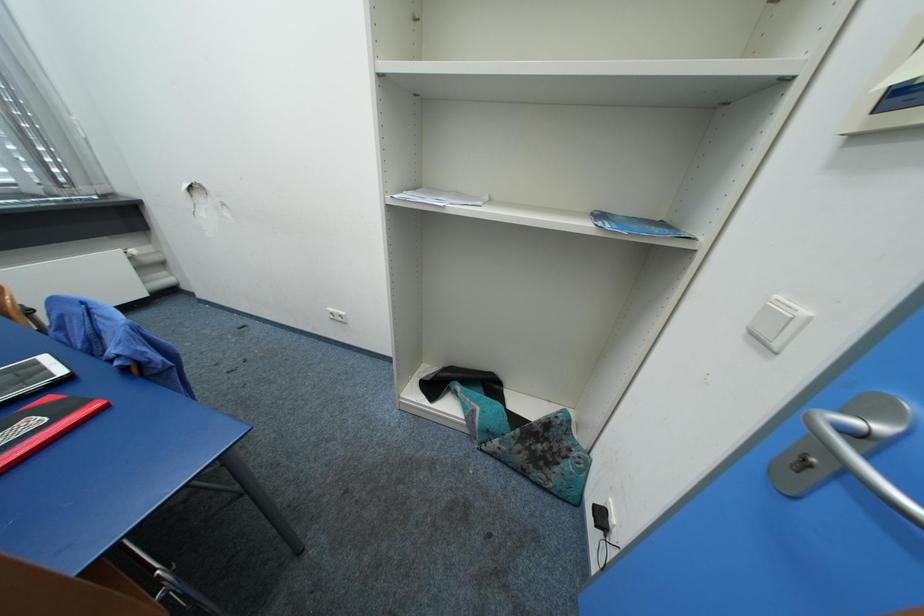
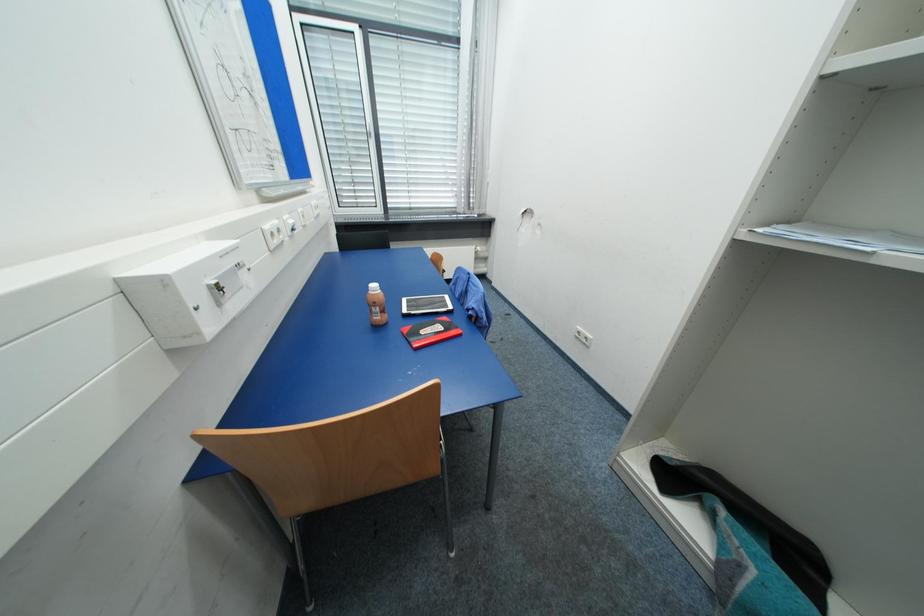
Question: How did the camera likely rotate?

Choices:
 (A) Left
 (B) Right
 (C) Up
 (D) Down

Answer: (A)